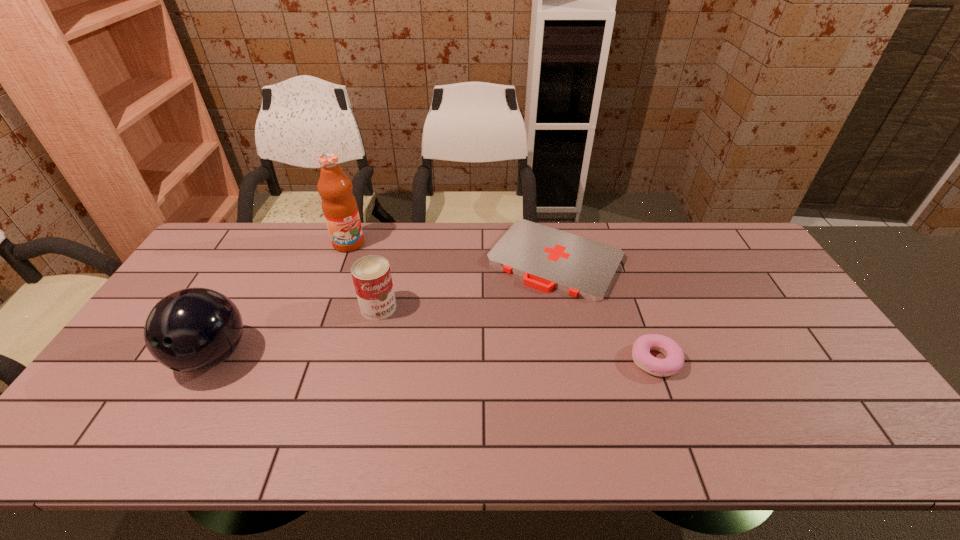
Locate an element on the screen. Image resolution: width=960 pixels, height=540 pixels. vacant area that lies between the pastry and the shortest object is located at coordinates (606, 310).

Image resolution: width=960 pixels, height=540 pixels. Identify the location of vacant region between the fourth shortest object and the second object from left to right. (280, 300).

At what (x,y) coordinates should I click in order to perform the action: click on vacant area between the can and the leftmost object. Please return your answer as a coordinate pair (x, y). The height and width of the screenshot is (540, 960). Looking at the image, I should click on (296, 332).

Locate an element on the screen. free space between the first-aid kit and the third object from left to right is located at coordinates (467, 284).

The width and height of the screenshot is (960, 540). Find the location of `empty space between the fruit juice and the fourth shortest object`. empty space between the fruit juice and the fourth shortest object is located at coordinates (280, 300).

The image size is (960, 540). I want to click on blank region between the third object from left to right and the pastry, so click(x=517, y=334).

Point out which object is positioned as the third nearest to the can. Please provide its 2D coordinates. Your answer should be formatted as a tuple, i.e. [(x, y)], where the tuple contains the x and y coordinates of a point satisfying the conditions above.

[(548, 258)]

I want to click on the second closest object to the fourth shortest object, so click(339, 206).

At what (x,y) coordinates should I click in order to perform the action: click on vacant region that satisfies the following two spatial constraints: 1. on the front side of the fruit juice; 2. on the left side of the pastry. Please return your answer as a coordinate pair (x, y). The height and width of the screenshot is (540, 960). Looking at the image, I should click on (306, 360).

Where is `free space that satisfies the following two spatial constraints: 1. on the side of the pastry with the finger holes; 2. on the right side of the bowling ball`? Image resolution: width=960 pixels, height=540 pixels. free space that satisfies the following two spatial constraints: 1. on the side of the pastry with the finger holes; 2. on the right side of the bowling ball is located at coordinates (209, 360).